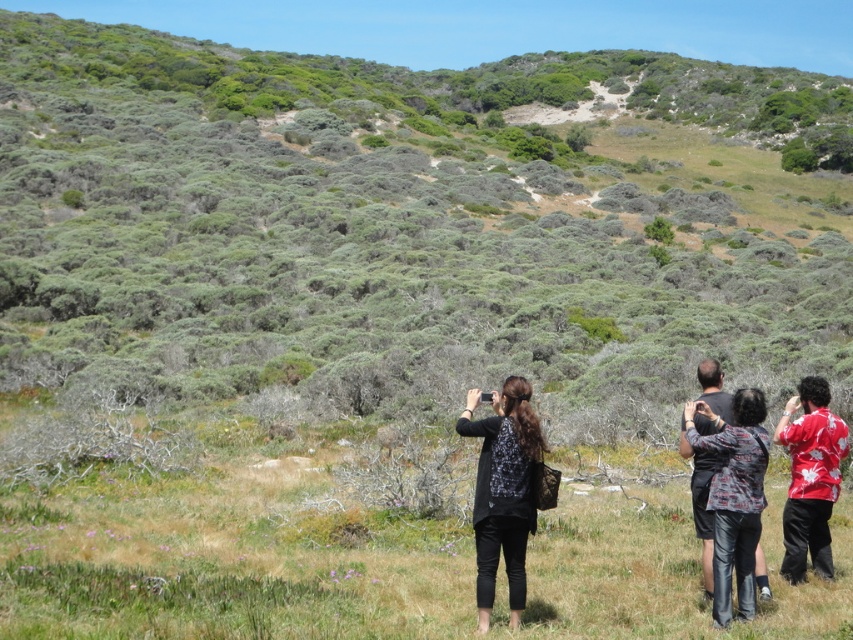
Question: Which object is farther from the camera taking this photo?

Choices:
 (A) black matte jacket at center
 (B) printed fabric shirt at center
 (C) red hawaiian shirt at right

Answer: (C)

Question: Does green grassy at center appear on the right side of black matte jacket at center?

Choices:
 (A) no
 (B) yes

Answer: (A)

Question: Based on their relative distances, which object is farther from the printed fabric shirt at center?

Choices:
 (A) green shrubbery at center
 (B) black matte jacket at center

Answer: (A)

Question: Which point is closer to the camera?

Choices:
 (A) red hawaiian shirt at right
 (B) green grassy at center
 (C) printed fabric shirt at center

Answer: (B)

Question: Does black matte jacket at center appear under printed fabric shirt at center?

Choices:
 (A) no
 (B) yes

Answer: (A)

Question: Can you confirm if black matte jacket at center is smaller than printed fabric shirt at center?

Choices:
 (A) yes
 (B) no

Answer: (B)